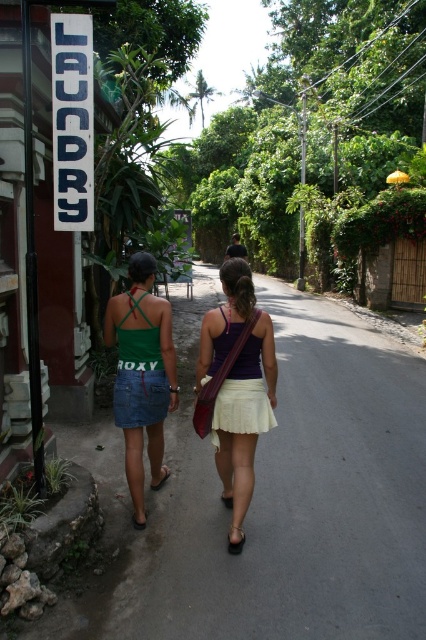
You are a fashion blogger standing on the street and see both the matte purple tank top at center and the green denim skirt at center. Which clothing item is positioned closer to you?

The matte purple tank top at center is closer to the viewer than the green denim skirt at center.

You are a fashion blogger standing on the street and see a person wearing the matte purple tank top at center and green denim skirt at center. Which clothing item is shorter in length?

The matte purple tank top at center is shorter in length compared to the green denim skirt at center.

You are standing at the point with coordinates point (264, 326) and want to walk towards the point with coordinates point (160, 346). According to the scene, will you be moving towards the building with the red door or away from it?

Since point (264, 326) is in front of point (160, 346), moving from point (264, 326) to point (160, 346) means you are moving away from the building with the red door.